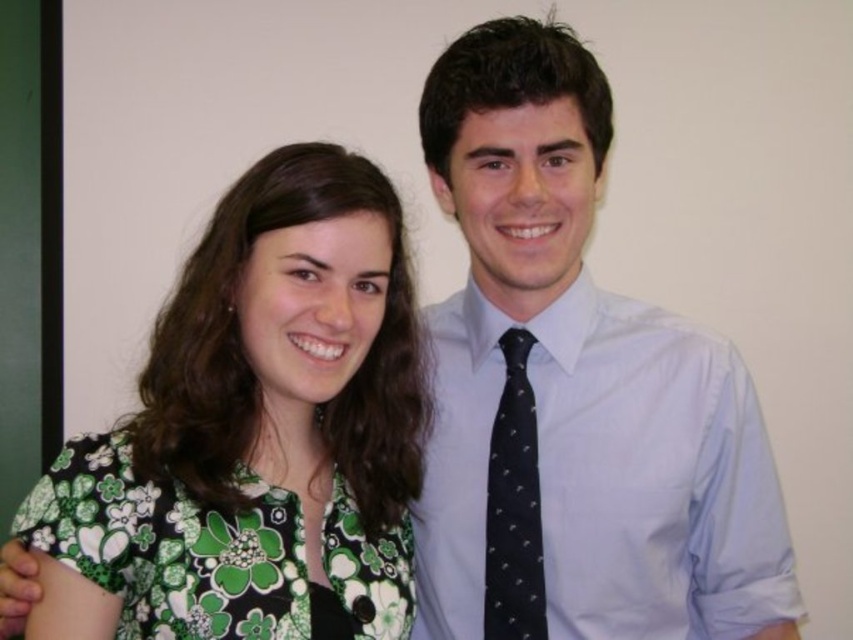
Question: Can you confirm if light blue shirt and tie at center is wider than black dotted tie at center?

Choices:
 (A) yes
 (B) no

Answer: (A)

Question: Can you confirm if green floral shirt at left is positioned to the right of black dotted tie at center?

Choices:
 (A) no
 (B) yes

Answer: (A)

Question: Which of the following is the closest to the observer?

Choices:
 (A) green floral shirt at left
 (B) green floral fabric dress at lower left

Answer: (B)

Question: Estimate the real-world distances between objects in this image. Which object is closer to the light blue shirt and tie at center?

Choices:
 (A) black dotted tie at center
 (B) green floral fabric dress at lower left
 (C) green floral shirt at left

Answer: (A)

Question: Which object is closer to the camera taking this photo?

Choices:
 (A) green floral fabric dress at lower left
 (B) light blue shirt and tie at center

Answer: (A)

Question: Can you confirm if green floral fabric dress at lower left is positioned above black dotted tie at center?

Choices:
 (A) no
 (B) yes

Answer: (A)